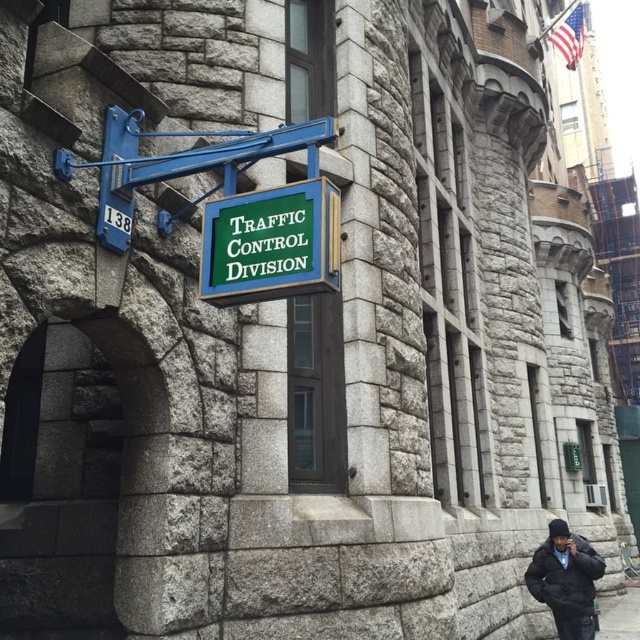
Does green plastic sign at center appear over black matte jacket at lower right?

Correct, green plastic sign at center is located above black matte jacket at lower right.

Consider the image. Does green plastic sign at center have a lesser height compared to black matte jacket at lower right?

Indeed, green plastic sign at center has a lesser height compared to black matte jacket at lower right.

You are a GUI agent. You are given a task and a screenshot of the screen. Output one action in this format:
    pyautogui.click(x=<x>, y=<y>)
    Task: Click on the green plastic sign at center
    Image resolution: width=640 pixels, height=640 pixels.
    Given the screenshot: What is the action you would take?
    pyautogui.click(x=269, y=243)

Identify the location of green plastic sign at center. (269, 243).

Can you confirm if green plastic sign at center is smaller than gray concrete pavement at lower right?

Correct, green plastic sign at center occupies less space than gray concrete pavement at lower right.

Is green plastic sign at center to the left of gray concrete pavement at lower right from the viewer's perspective?

Correct, you'll find green plastic sign at center to the left of gray concrete pavement at lower right.

Is point (275, 234) farther from camera compared to point (636, 600)?

No, it is not.

The height and width of the screenshot is (640, 640). I want to click on green plastic sign at center, so click(269, 243).

Between black matte jacket at lower right and gray concrete pavement at lower right, which one has more height?

Standing taller between the two is gray concrete pavement at lower right.

In the scene shown: Is black matte jacket at lower right to the left of gray concrete pavement at lower right from the viewer's perspective?

Yes, black matte jacket at lower right is to the left of gray concrete pavement at lower right.

The width and height of the screenshot is (640, 640). Find the location of `black matte jacket at lower right`. black matte jacket at lower right is located at coordinates (564, 579).